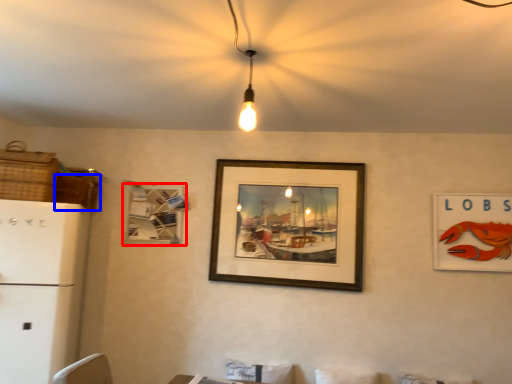
Question: Which point is further to the camera, picture frame (highlighted by a red box) or basket (highlighted by a blue box)?

Choices:
 (A) picture frame
 (B) basket

Answer: (A)